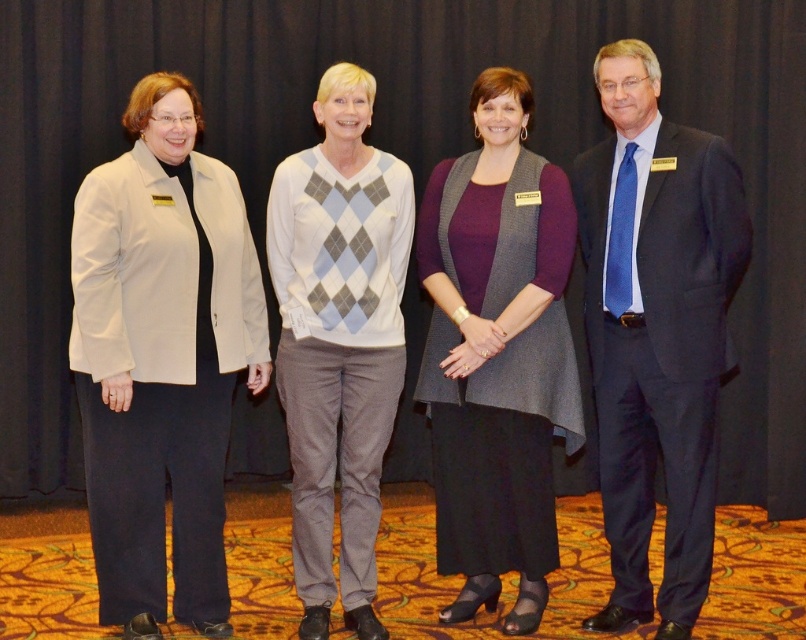
You are organizing a photo shoot and need to position the dark blue suit at right in a specific location. According to the coordinates provided, where exactly should you place it?

The dark blue suit at right should be placed at the coordinates point (x=655, y=332).

You are a photographer at the event and need to ensure all participants fit in a group photo. Based on the image, which participant is wearing a beige fabric jacket at left and will you need to adjust their position to ensure they fit within the frame if the white argyle sweater at center is already centered?

The beige fabric jacket at left is wider than the white argyle sweater at center. To ensure the beige fabric jacket at left fits within the frame, you may need to adjust their position slightly to the left to accommodate its width.

Looking at this image, you are a photographer setting up for a group photo. You need to ensure that the beige fabric jacket at left and the white argyle sweater at center are at least 18 inches apart for proper framing. Based on the current positioning, is this requirement met?

The distance between the beige fabric jacket at left and the white argyle sweater at center is 17.77 inches, which is slightly less than the required 18 inches. Therefore, the requirement is not met, and they need to move slightly farther apart.